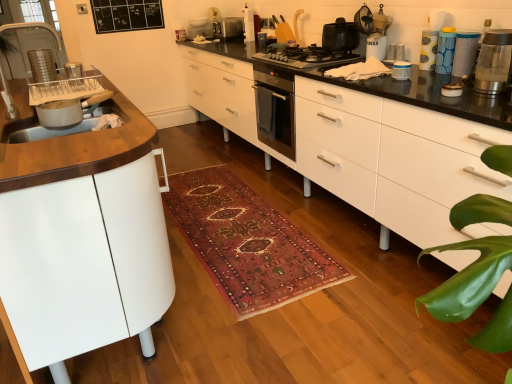
The width and height of the screenshot is (512, 384). In order to click on free space to the right of white glossy container at upper right, which is the 2th appliance in front-to-back order in this screenshot , I will do `click(440, 68)`.